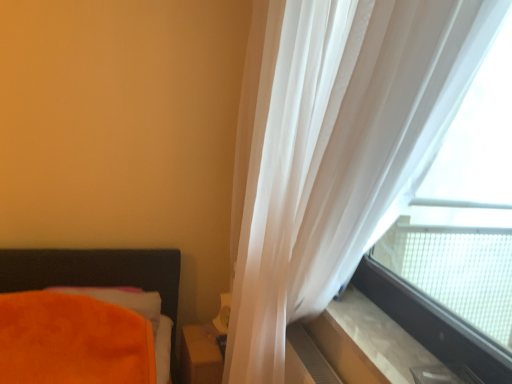
Question: Considering their positions, is orange plush pillow at lower left located in front of or behind matte brown wooden table at lower center?

Choices:
 (A) behind
 (B) front

Answer: (B)

Question: Considering the positions of orange plush pillow at lower left and matte brown wooden table at lower center in the image, is orange plush pillow at lower left bigger or smaller than matte brown wooden table at lower center?

Choices:
 (A) big
 (B) small

Answer: (A)

Question: Estimate the real-world distances between objects in this image. Which object is closer to the translucent fabric at upper right?

Choices:
 (A) beige marble window sill at lower right
 (B) translucent white curtain at right
 (C) orange plush pillow at lower left
 (D) matte brown wooden table at lower center

Answer: (A)

Question: Which is farther from the beige marble window sill at lower right?

Choices:
 (A) orange plush pillow at lower left
 (B) matte brown wooden table at lower center
 (C) translucent white curtain at right
 (D) translucent fabric at upper right

Answer: (A)